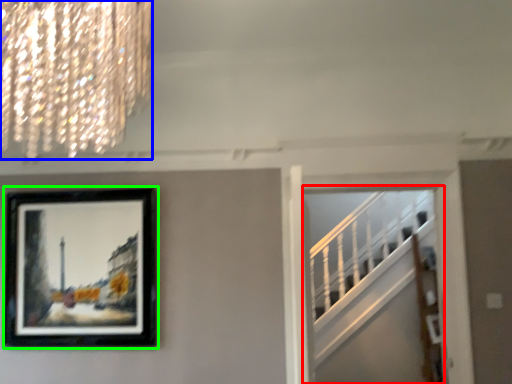
Question: Which object is the farthest from escalator (highlighted by a red box)? Choose among these: lamp (highlighted by a blue box) or picture frame (highlighted by a green box).

Choices:
 (A) lamp
 (B) picture frame

Answer: (A)